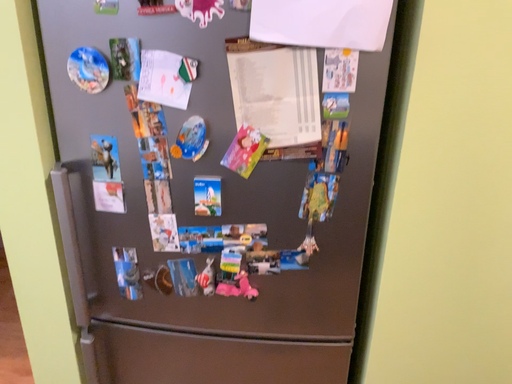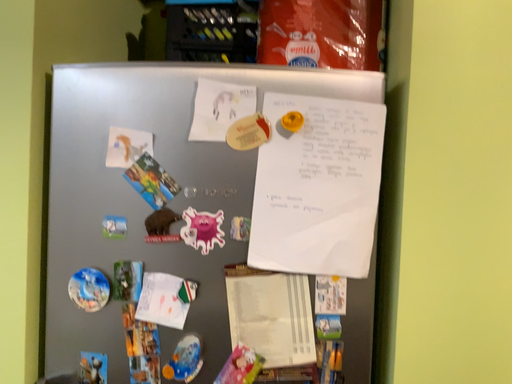
Question: Which way did the camera rotate in the video?

Choices:
 (A) rotated downward
 (B) rotated upward

Answer: (B)